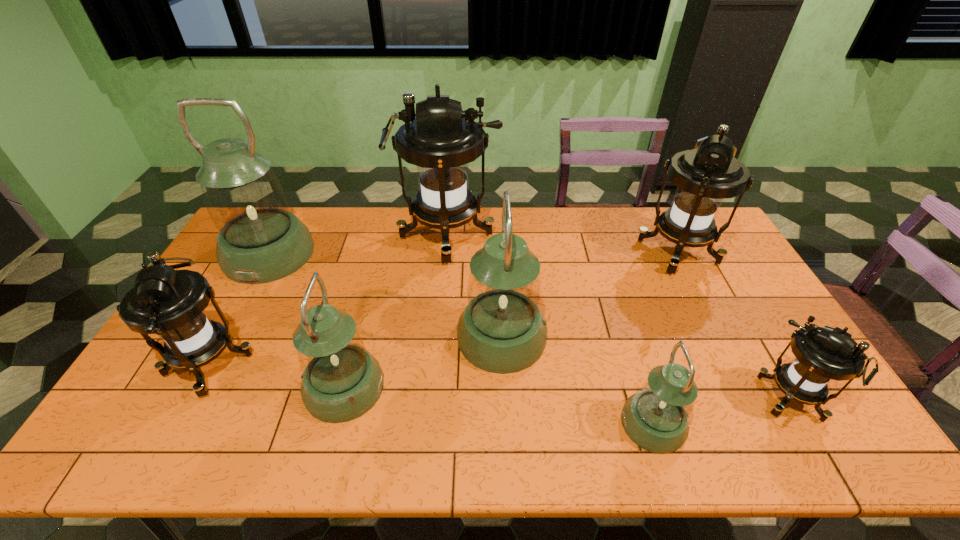
I want to click on object present at the near right corner, so click(822, 354).

Where is `free space at the far edge`? Image resolution: width=960 pixels, height=540 pixels. free space at the far edge is located at coordinates (347, 235).

Identify the location of free spot between the biggest black lantern and the farthest greenish lantern. (358, 245).

You are a GUI agent. You are given a task and a screenshot of the screen. Output one action in this format:
    pyautogui.click(x=<x>, y=<y>)
    Task: Click on the vacant space in between the smallest black lantern and the second smallest black lantern
    The width and height of the screenshot is (960, 540).
    Given the screenshot: What is the action you would take?
    pyautogui.click(x=501, y=382)

Where is `vacant space that is in between the sixth object from left to right and the smallest black lantern`? vacant space that is in between the sixth object from left to right and the smallest black lantern is located at coordinates (723, 412).

This screenshot has height=540, width=960. I want to click on vacant area that lies between the third smallest black lantern and the smallest black lantern, so tap(734, 326).

At what (x,y) coordinates should I click in order to perform the action: click on vacant space in between the second biggest black lantern and the leftmost black lantern. Please return your answer as a coordinate pair (x, y). Looking at the image, I should click on (444, 307).

The image size is (960, 540). I want to click on blank region between the third biggest black lantern and the leftmost greenish lantern, so click(240, 309).

Identify the location of vacant space that is in between the third object from right to left and the third biggest greenish lantern. The height and width of the screenshot is (540, 960). (499, 406).

I want to click on free space between the second black lantern from left to right and the second smallest black lantern, so click(x=329, y=300).